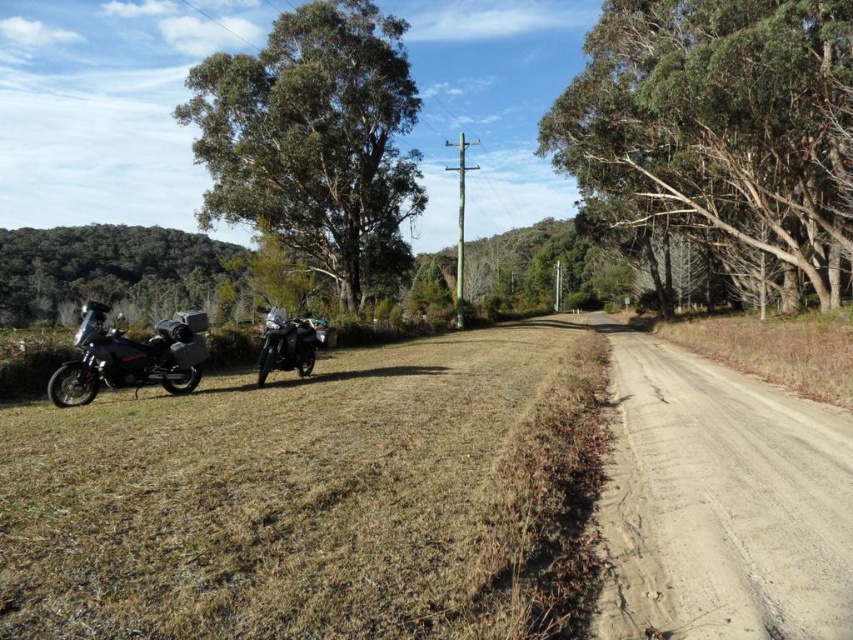
Question: Which object appears closest to the camera in this image?

Choices:
 (A) brown dry grass at lower left
 (B) green rough bark tree at upper left
 (C) shiny metallic motorcycle at center

Answer: (A)

Question: Can you confirm if brown dry grass at lower left is thinner than green rough bark tree at upper left?

Choices:
 (A) no
 (B) yes

Answer: (B)

Question: Does brown dry grass at lower left appear under shiny metallic motorcycle at center?

Choices:
 (A) no
 (B) yes

Answer: (B)

Question: Which point is farther to the camera?

Choices:
 (A) (695, 621)
 (B) (277, 314)
 (C) (315, 108)

Answer: (C)

Question: Can you confirm if dusty gravel road at right is positioned below matte black motorcycle at left?

Choices:
 (A) yes
 (B) no

Answer: (A)

Question: Which point is closer to the camera taking this photo?

Choices:
 (A) (625, 621)
 (B) (271, 333)
 (C) (540, 444)
 (D) (325, 100)

Answer: (A)